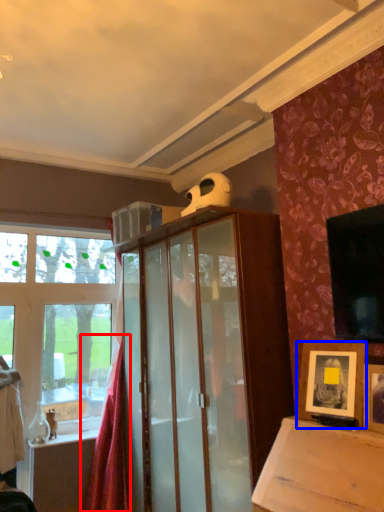
Question: Which of the following is the farthest to the observer, curtain (highlighted by a red box) or picture frame (highlighted by a blue box)?

Choices:
 (A) curtain
 (B) picture frame

Answer: (A)